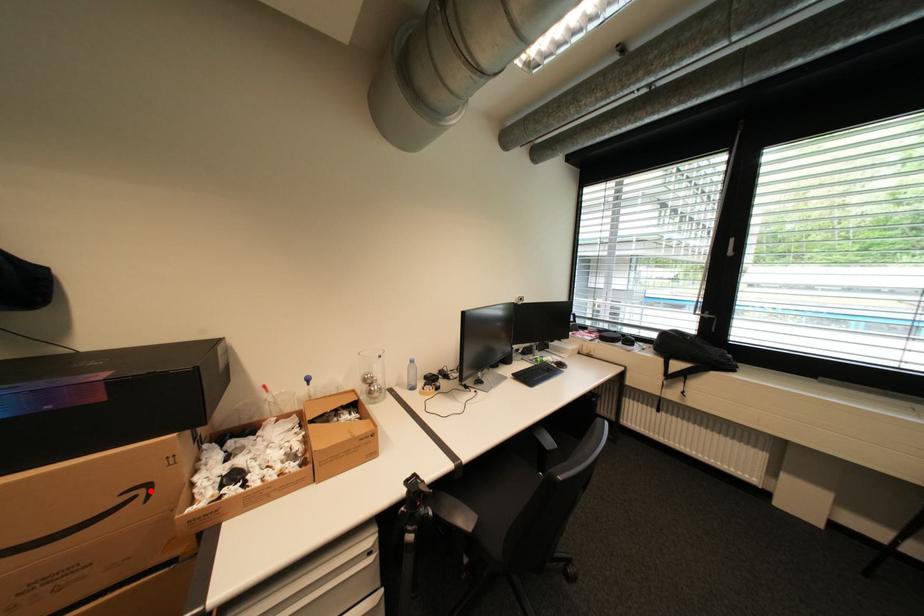
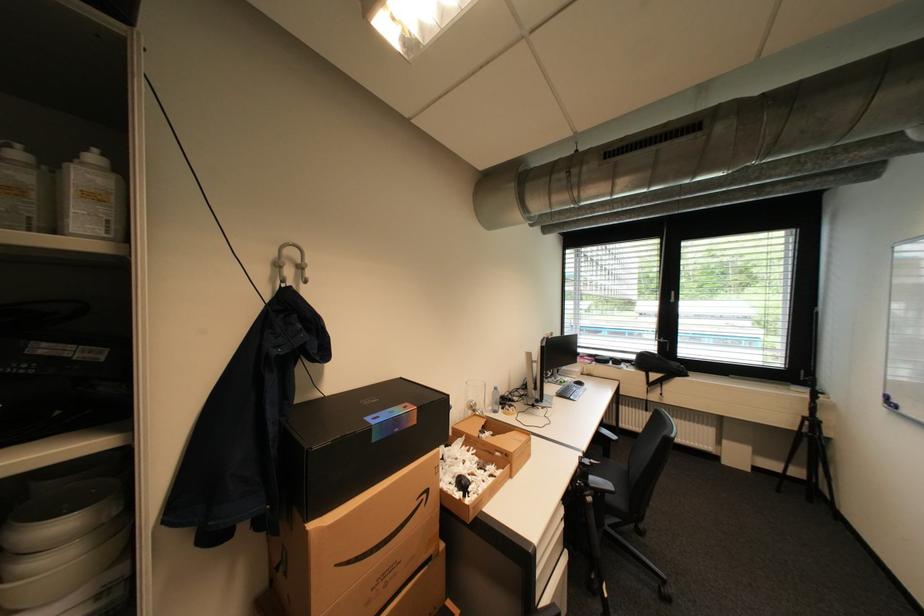
Question: I am providing you with two images of the same scene from different viewpoints. Given a red point in image1, look at the same physical point in image2. Is it:

Choices:
 (A) Closer to the viewpoint
 (B) Farther from the viewpoint

Answer: (B)